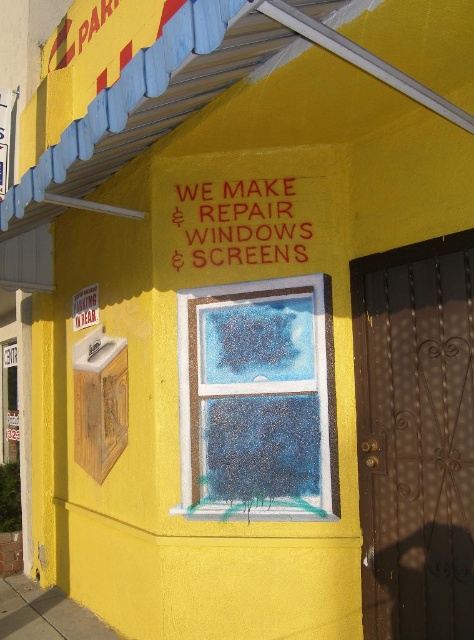
Which is below, blue frosted glass window at center or red rubber sign at center?

blue frosted glass window at center is below.

Is blue frosted glass window at center taller than red rubber sign at center?

Correct, blue frosted glass window at center is much taller as red rubber sign at center.

Is point (240, 362) in front of point (266, 188)?

Yes, point (240, 362) is closer to viewer.

Where is `blue frosted glass window at center`? blue frosted glass window at center is located at coordinates (257, 400).